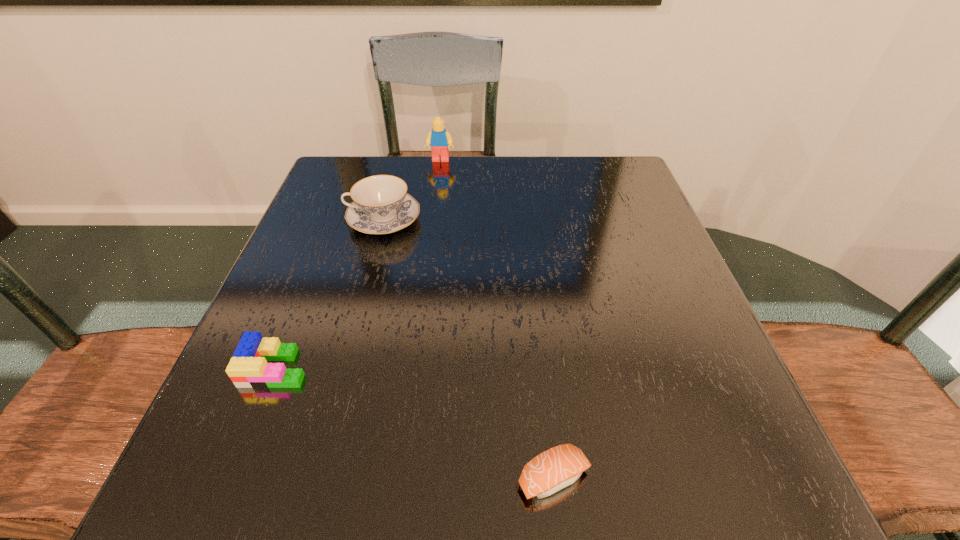
Where is `free point at the right edge`? The height and width of the screenshot is (540, 960). free point at the right edge is located at coordinates (651, 301).

In the image, there is a desktop. At what (x,y) coordinates should I click in order to perform the action: click on vacant area at the far left corner. Please return your answer as a coordinate pair (x, y). Image resolution: width=960 pixels, height=540 pixels. Looking at the image, I should click on (332, 177).

Where is `free space at the near left corner of the desktop`? free space at the near left corner of the desktop is located at coordinates (185, 500).

In the image, there is a desktop. At what (x,y) coordinates should I click in order to perform the action: click on free space at the far right corner. Please return your answer as a coordinate pair (x, y). Looking at the image, I should click on (604, 193).

The image size is (960, 540). I want to click on vacant space that is in between the sushi and the tallest object, so click(x=497, y=319).

Find the location of a particular element. free spot between the shorter Lego and the tallest object is located at coordinates (358, 264).

Locate an element on the screen. This screenshot has height=540, width=960. unoccupied position between the second farthest object and the taller Lego is located at coordinates (412, 190).

The image size is (960, 540). In order to click on vacant space that's between the nearer Lego and the shortest object in this screenshot , I will do `click(415, 423)`.

Locate an element on the screen. free space that is in between the left Lego and the rightmost object is located at coordinates (415, 423).

Image resolution: width=960 pixels, height=540 pixels. Find the location of `empty space between the third tallest object and the rightmost object`. empty space between the third tallest object and the rightmost object is located at coordinates (415, 423).